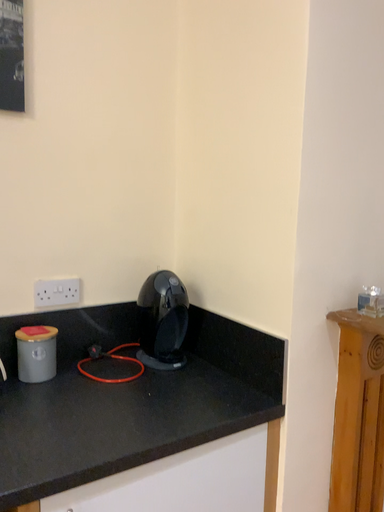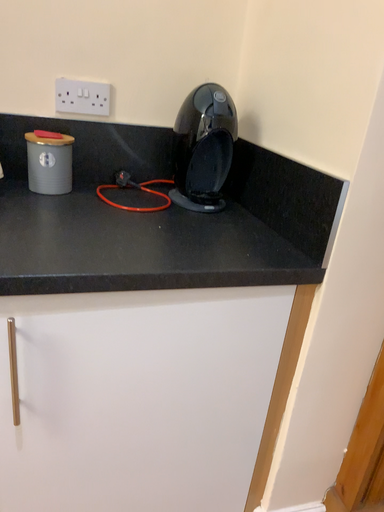
Question: Which way did the camera rotate in the video?

Choices:
 (A) rotated left
 (B) rotated right

Answer: (A)